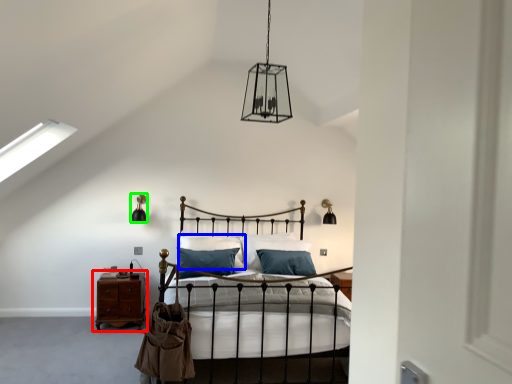
Question: Estimate the real-world distances between objects in this image. Which object is farther from nightstand (highlighted by a red box), pillow (highlighted by a blue box) or light fixture (highlighted by a green box)?

Choices:
 (A) pillow
 (B) light fixture

Answer: (B)